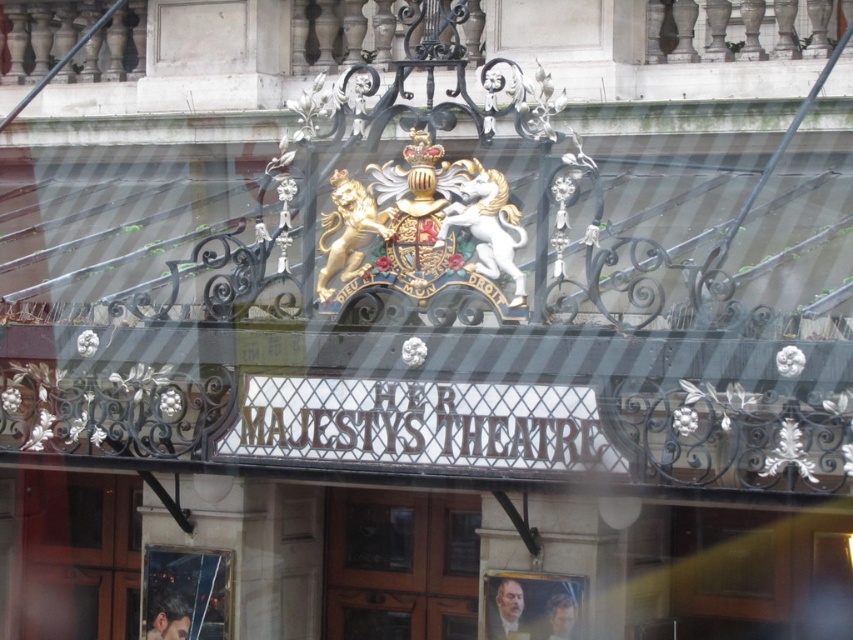
Can you confirm if transparent glass window at lower left is thinner than matte glass portrait at lower center?

Incorrect, transparent glass window at lower left's width is not less than matte glass portrait at lower center's.

Between point (194, 566) and point (498, 628), which one is positioned in front?

Point (498, 628)

Find the location of a particular element. The height and width of the screenshot is (640, 853). transparent glass window at lower left is located at coordinates (184, 593).